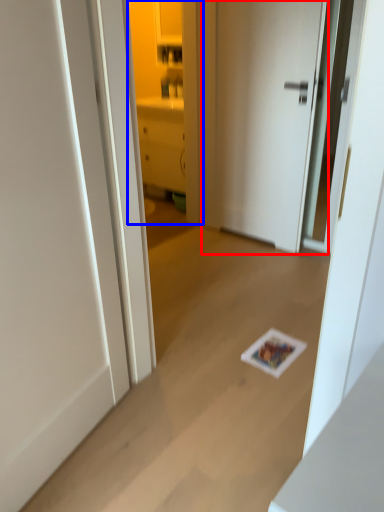
Question: Which of the following is the farthest to the observer, door (highlighted by a red box) or cabinetry (highlighted by a blue box)?

Choices:
 (A) door
 (B) cabinetry

Answer: (B)